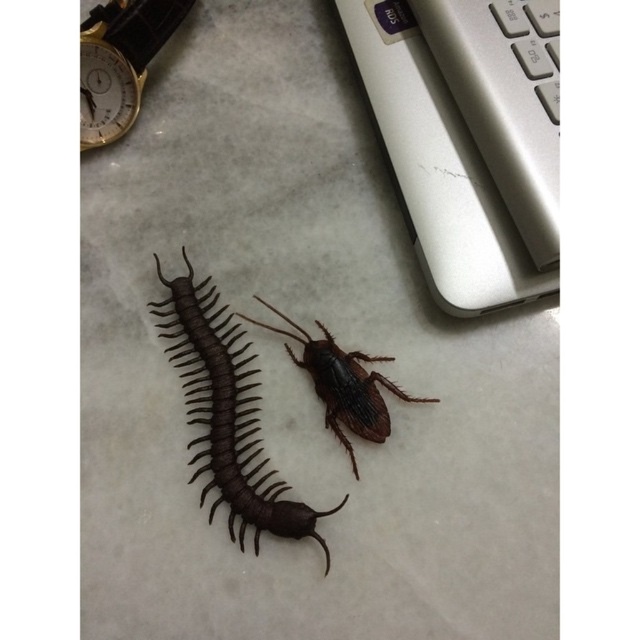
Question: Is gold metallic watch at upper left further to camera compared to gold metallic clock at upper left?

Choices:
 (A) yes
 (B) no

Answer: (B)

Question: Is brown matte centipede at center-left above gold metallic watch at upper left?

Choices:
 (A) yes
 (B) no

Answer: (B)

Question: Can you confirm if gold metallic watch at upper left is smaller than shiny brown beetle at center?

Choices:
 (A) no
 (B) yes

Answer: (B)

Question: Which point is closer to the camera taking this photo?

Choices:
 (A) (288, 348)
 (B) (93, 77)
 (C) (260, 496)

Answer: (C)

Question: Which point is farther from the camera taking this photo?

Choices:
 (A) (109, 77)
 (B) (326, 554)
 (C) (108, 120)

Answer: (C)

Question: Which point is closer to the camera?

Choices:
 (A) (108, 122)
 (B) (97, 141)
 (C) (227, 339)
 (D) (260, 300)

Answer: (C)